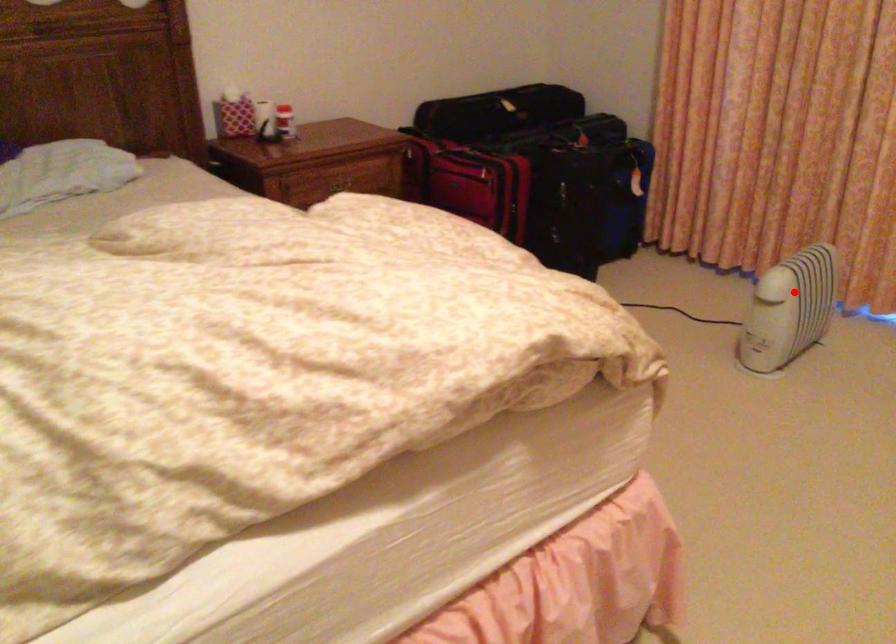
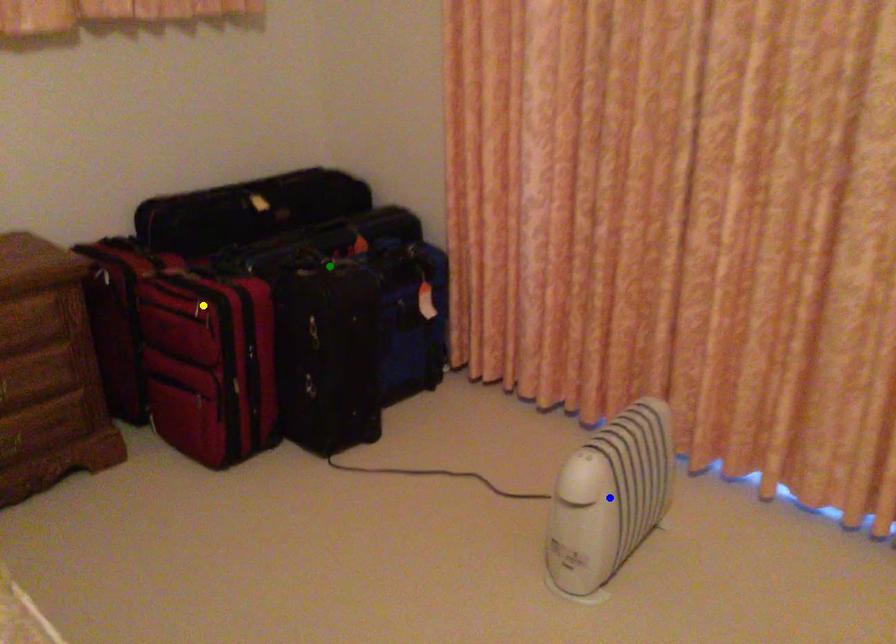
Question: I am providing you with two images of the same scene from different viewpoints. A red point is marked on the first image. You are given multiple points on the second image. Which point in image 2 is actually the same real-world point as the red point in image 1?

Choices:
 (A) blue point
 (B) green point
 (C) yellow point

Answer: (A)